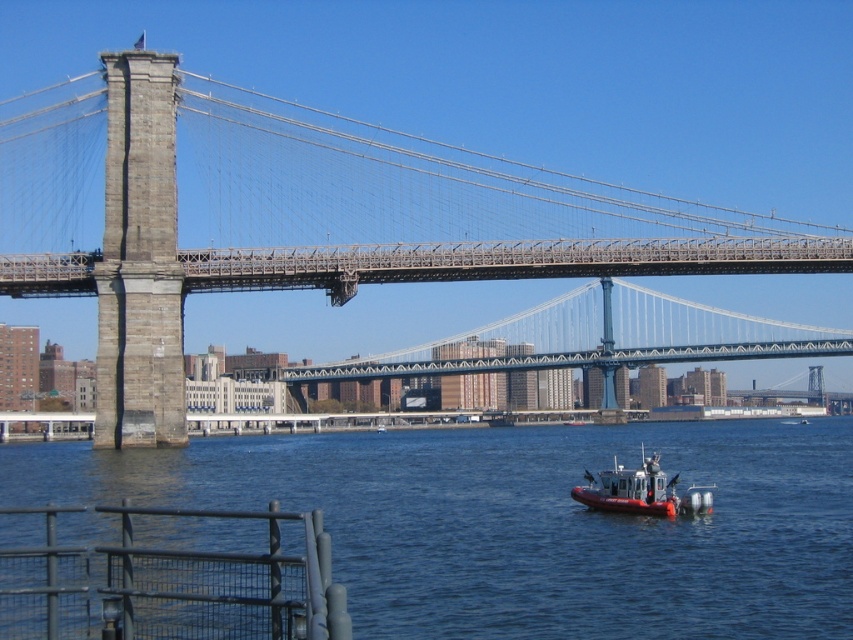
You are a tourist standing on the Brooklyn Bridge and looking down. You see the blue water at lower center and the stone bridge at center. Which object is closer to your feet?

The stone bridge at center is closer to your feet because you are standing on it, while the blue water at lower center is below the bridge.